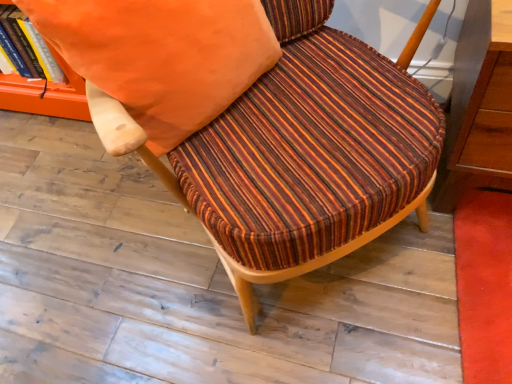
Question: From a real-world perspective, is striped fabric chair at center located higher than orange fabric book at upper left?

Choices:
 (A) yes
 (B) no

Answer: (A)

Question: From a real-world perspective, does striped fabric chair at center sit lower than orange fabric book at upper left?

Choices:
 (A) no
 (B) yes

Answer: (A)

Question: Is striped fabric chair at center shorter than orange fabric book at upper left?

Choices:
 (A) no
 (B) yes

Answer: (A)

Question: Does striped fabric chair at center turn towards orange fabric book at upper left?

Choices:
 (A) no
 (B) yes

Answer: (A)

Question: From the image's perspective, is striped fabric chair at center on top of orange fabric book at upper left?

Choices:
 (A) yes
 (B) no

Answer: (B)

Question: In terms of height, does orange fabric pillow at upper center look taller or shorter compared to orange fabric book at upper left?

Choices:
 (A) tall
 (B) short

Answer: (A)

Question: Based on their positions, is orange fabric pillow at upper center located to the left or right of orange fabric book at upper left?

Choices:
 (A) right
 (B) left

Answer: (A)

Question: From a real-world perspective, is orange fabric pillow at upper center above or below orange fabric book at upper left?

Choices:
 (A) above
 (B) below

Answer: (A)

Question: From the image's perspective, is orange fabric pillow at upper center located above or below orange fabric book at upper left?

Choices:
 (A) above
 (B) below

Answer: (B)

Question: From the image's perspective, is orange fabric book at upper left positioned above or below striped fabric chair at center?

Choices:
 (A) below
 (B) above

Answer: (B)

Question: Looking at the image, does orange fabric book at upper left seem bigger or smaller compared to striped fabric chair at center?

Choices:
 (A) big
 (B) small

Answer: (B)

Question: Relative to striped fabric chair at center, is orange fabric book at upper left in front or behind?

Choices:
 (A) behind
 (B) front

Answer: (A)

Question: In the image, is orange fabric book at upper left on the left side or the right side of striped fabric chair at center?

Choices:
 (A) right
 (B) left

Answer: (B)

Question: From the image's perspective, is striped fabric chair at center positioned above or below orange fabric pillow at upper center?

Choices:
 (A) above
 (B) below

Answer: (B)

Question: In the image, is striped fabric chair at center on the left side or the right side of orange fabric pillow at upper center?

Choices:
 (A) right
 (B) left

Answer: (A)